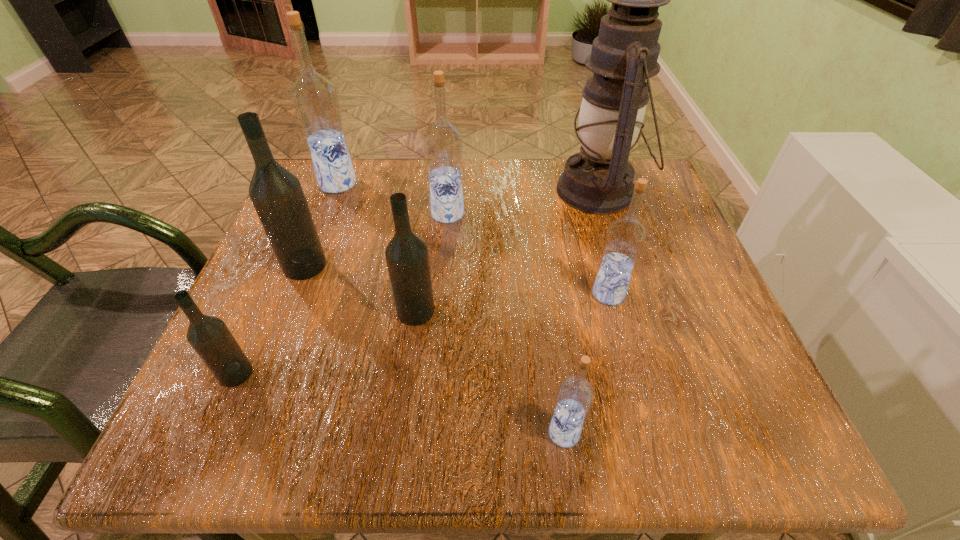
I want to click on the second smallest blue vodka, so click(626, 236).

Identify the location of the second nearest vodka. Image resolution: width=960 pixels, height=540 pixels. (209, 336).

At what (x,y) coordinates should I click in order to perform the action: click on the seventh farthest object. Please return your answer as a coordinate pair (x, y). Image resolution: width=960 pixels, height=540 pixels. Looking at the image, I should click on (209, 336).

This screenshot has width=960, height=540. I want to click on the second blue vodka from right to left, so click(575, 395).

This screenshot has width=960, height=540. Find the location of `the smallest blue vodka`. the smallest blue vodka is located at coordinates (575, 395).

Locate an element on the screen. This screenshot has height=540, width=960. vacant space located 0.290m on the left of the oil lamp is located at coordinates (430, 191).

You are a GUI agent. You are given a task and a screenshot of the screen. Output one action in this format:
    pyautogui.click(x=<x>, y=<y>)
    Task: Click on the vacant region located 0.290m on the front of the farthest blue vodka
    
    Given the screenshot: What is the action you would take?
    pyautogui.click(x=297, y=289)

I want to click on vacant space located 0.350m on the front of the second blue vodka from left to right, so click(435, 369).

You are a GUI agent. You are given a task and a screenshot of the screen. Output one action in this format:
    pyautogui.click(x=<x>, y=<y>)
    Task: Click on the vacant space located on the right of the fourth farthest object
    The height and width of the screenshot is (540, 960).
    Given the screenshot: What is the action you would take?
    pyautogui.click(x=472, y=265)

The width and height of the screenshot is (960, 540). Identify the location of free point located 0.140m on the front of the rightmost black vodka. (404, 402).